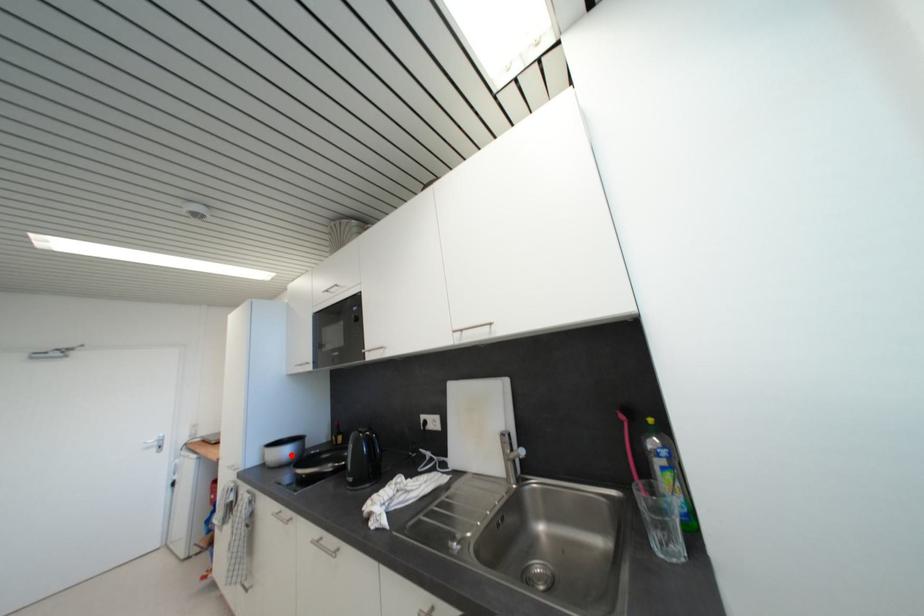
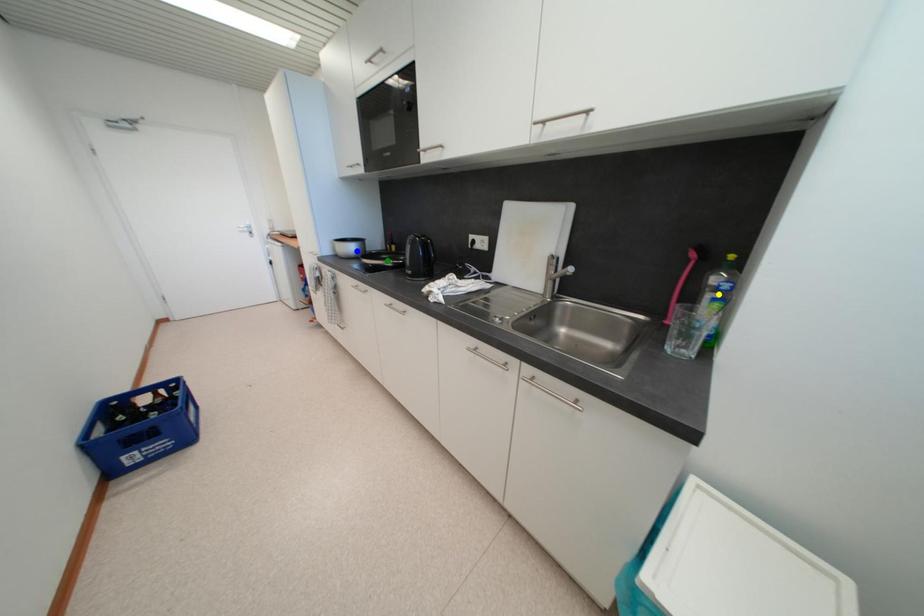
Question: I am providing you with two images of the same scene from different viewpoints. A red point is marked on the first image. You are given multiple points on the second image. Which point in image 2 represents the same 3d spot as the red point in image 1?

Choices:
 (A) yellow point
 (B) green point
 (C) blue point

Answer: (C)